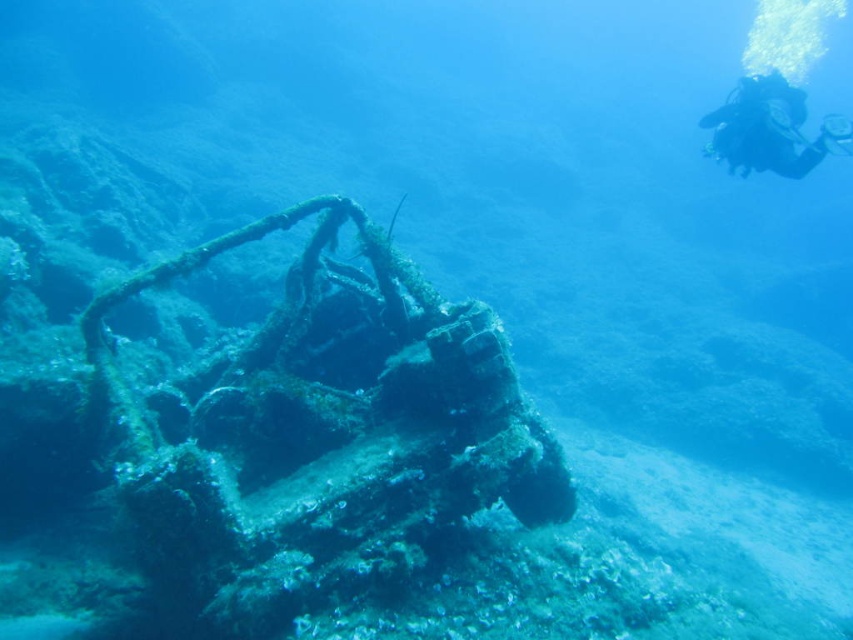
You are a marine biologist planning to study the rusty metal shipwreck at center and the black scuba diver at upper right. Based on their sizes, which object would require a larger storage container for transport?

The rusty metal shipwreck at center is much taller than the black scuba diver at upper right, so it would require a larger storage container for transport.

You are a marine biologist observing the underwater scene. You need to document the position of the rusty metal shipwreck at center relative to the black scuba diver at upper right. Which side of the diver is the shipwreck located on?

The rusty metal shipwreck at center is to the left of the black scuba diver at upper right.